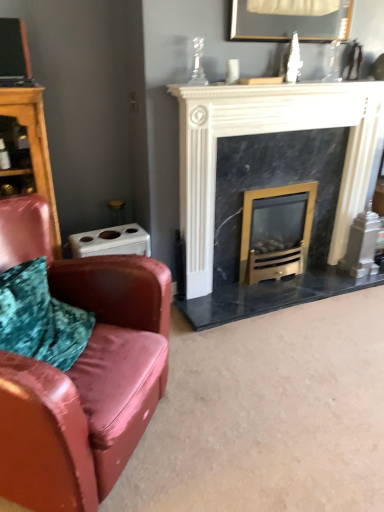
What do you see at coordinates (35, 146) in the screenshot? I see `wooden dresser at left` at bounding box center [35, 146].

I want to click on black marble fireplace at center, so click(268, 132).

The height and width of the screenshot is (512, 384). What do you see at coordinates (268, 132) in the screenshot? I see `black marble fireplace at center` at bounding box center [268, 132].

Where is `gold metallic wood burning stove at center`? gold metallic wood burning stove at center is located at coordinates (276, 231).

Is point (76, 488) farther from viewer compared to point (37, 101)?

No, it is in front of (37, 101).

Looking at the image, does leather couch at left seem bigger or smaller compared to wooden dresser at left?

Clearly, leather couch at left is larger in size than wooden dresser at left.

From a real-world perspective, relative to wooden dresser at left, is leather couch at left vertically above or below?

Clearly, from a real-world perspective, leather couch at left is below wooden dresser at left.

From the image's perspective, is leather couch at left above or below wooden dresser at left?

leather couch at left is below wooden dresser at left.

Is gold metallic wood burning stove at center not close to leather couch at left?

Absolutely, gold metallic wood burning stove at center is distant from leather couch at left.

Between gold metallic wood burning stove at center and leather couch at left, which one has larger size?

leather couch at left.

Is gold metallic wood burning stove at center positioned with its back to leather couch at left?

No, gold metallic wood burning stove at center is not facing the opposite direction of leather couch at left.

Would you consider gold metallic wood burning stove at center to be distant from black marble fireplace at center?

gold metallic wood burning stove at center is near black marble fireplace at center, not far away.

Which object is further away from the camera, gold metallic wood burning stove at center or black marble fireplace at center?

Positioned behind is gold metallic wood burning stove at center.

Is leather couch at left at the back of wooden dresser at left?

That's not correct — wooden dresser at left is not looking away from leather couch at left.

Would you say wooden dresser at left is outside leather couch at left?

Yes, wooden dresser at left is outside of leather couch at left.

From a real-world perspective, is wooden dresser at left on top of leather couch at left?

Yes, from a real-world perspective, wooden dresser at left is over leather couch at left

Visually, is wooden dresser at left positioned to the left or to the right of leather couch at left?

From the image, it's evident that wooden dresser at left is to the left of leather couch at left.

From a real-world perspective, which is physically below, leather couch at left or gold metallic wood burning stove at center?

In real-world perspective, gold metallic wood burning stove at center is lower.

How far apart are leather couch at left and gold metallic wood burning stove at center?

leather couch at left is 4.25 feet away from gold metallic wood burning stove at center.

Is gold metallic wood burning stove at center at the back of leather couch at left?

leather couch at left is not turned away from gold metallic wood burning stove at center.

Which of these two, leather couch at left or gold metallic wood burning stove at center, is thinner?

gold metallic wood burning stove at center.

This screenshot has width=384, height=512. There is a gold metallic wood burning stove at center. In order to click on dresser above it (from a real-world perspective) in this screenshot , I will do `click(35, 146)`.

How much distance is there between gold metallic wood burning stove at center and wooden dresser at left?

gold metallic wood burning stove at center is 1.29 meters away from wooden dresser at left.

From the image's perspective, which object appears higher, gold metallic wood burning stove at center or wooden dresser at left?

wooden dresser at left appears higher in the image.

Could you tell me if gold metallic wood burning stove at center is turned towards wooden dresser at left?

No, gold metallic wood burning stove at center is not oriented towards wooden dresser at left.

Considering the sizes of objects black marble fireplace at center and leather couch at left in the image provided, who is taller, black marble fireplace at center or leather couch at left?

Standing taller between the two is black marble fireplace at center.

Looking at this image, from the image's perspective, is black marble fireplace at center located beneath leather couch at left?

Incorrect, from the image's perspective, black marble fireplace at center is higher than leather couch at left.

Measure the distance between black marble fireplace at center and leather couch at left.

They are 1.13 meters apart.

Relative to leather couch at left, is black marble fireplace at center in front or behind?

black marble fireplace at center is positioned farther from the viewer than leather couch at left.

In order to click on dresser behind the leather couch at left in this screenshot , I will do `click(35, 146)`.

The width and height of the screenshot is (384, 512). Find the location of `chair in front of the gold metallic wood burning stove at center`. chair in front of the gold metallic wood burning stove at center is located at coordinates click(81, 372).

In the scene shown: Considering their positions, is gold metallic wood burning stove at center positioned further to leather couch at left than wooden dresser at left?

gold metallic wood burning stove at center lies further to leather couch at left than the other object.

Which object lies nearer to the anchor point wooden dresser at left, leather couch at left or black marble fireplace at center?

leather couch at left.

Based on their spatial positions, is black marble fireplace at center or wooden dresser at left further from gold metallic wood burning stove at center?

wooden dresser at left is further to gold metallic wood burning stove at center.

Which object lies nearer to the anchor point wooden dresser at left, black marble fireplace at center or gold metallic wood burning stove at center?

Based on the image, black marble fireplace at center appears to be nearer to wooden dresser at left.

Considering their positions, is wooden dresser at left positioned further to leather couch at left than black marble fireplace at center?

black marble fireplace at center is positioned further to the anchor leather couch at left.

Considering their positions, is gold metallic wood burning stove at center positioned further to wooden dresser at left than black marble fireplace at center?

Based on the image, gold metallic wood burning stove at center appears to be further to wooden dresser at left.

Based on their spatial positions, is black marble fireplace at center or gold metallic wood burning stove at center closer to leather couch at left?

black marble fireplace at center lies closer to leather couch at left than the other object.

From the image, which object appears to be farther from black marble fireplace at center, leather couch at left or gold metallic wood burning stove at center?

leather couch at left.

At what (x,y) coordinates should I click in order to perform the action: click on dresser located between leather couch at left and gold metallic wood burning stove at center in the depth direction. Please return your answer as a coordinate pair (x, y). Looking at the image, I should click on (35, 146).

Identify the location of wood burning stove between wooden dresser at left and black marble fireplace at center in the horizontal direction. The height and width of the screenshot is (512, 384). tap(276, 231).

Locate an element on the screen. Image resolution: width=384 pixels, height=512 pixels. fireplace between leather couch at left and gold metallic wood burning stove at center in the front-back direction is located at coordinates (268, 132).

Identify the location of chair located between wooden dresser at left and black marble fireplace at center in the left-right direction. The height and width of the screenshot is (512, 384). (81, 372).